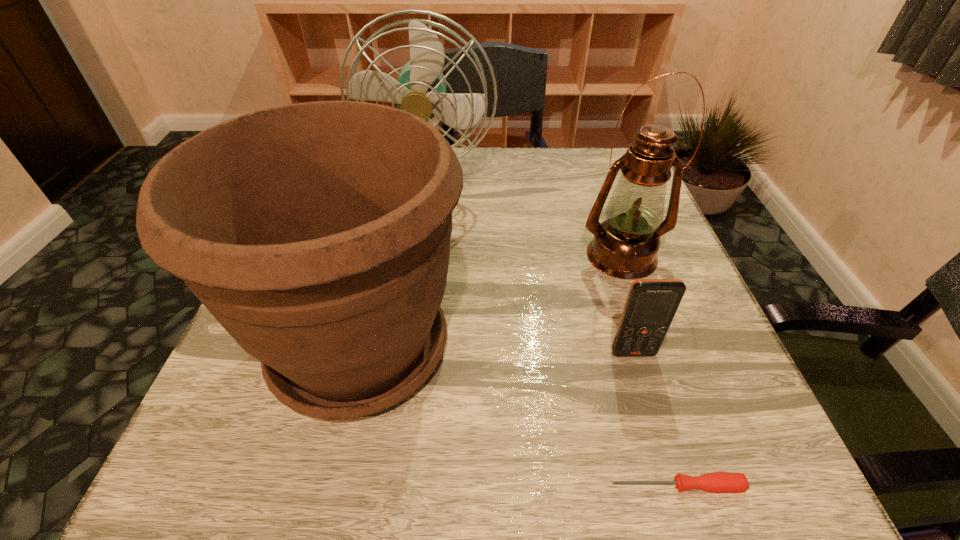
Locate an element on the screen. screwdriver that is at the right edge is located at coordinates (720, 482).

Where is `object that is at the far left corner`? Image resolution: width=960 pixels, height=540 pixels. object that is at the far left corner is located at coordinates coord(420,89).

Locate an element on the screen. object located at the near left corner is located at coordinates (317, 234).

Locate an element on the screen. The height and width of the screenshot is (540, 960). object located at the near right corner is located at coordinates (720, 482).

Locate an element on the screen. Image resolution: width=960 pixels, height=540 pixels. free spot at the far edge of the desktop is located at coordinates click(x=499, y=167).

The height and width of the screenshot is (540, 960). In order to click on free region at the near edge of the desktop in this screenshot , I will do `click(597, 498)`.

Find the location of a particular element. vacant space at the right edge of the desktop is located at coordinates (699, 328).

In the image, there is a desktop. Where is `vacant space at the far right corner`? Image resolution: width=960 pixels, height=540 pixels. vacant space at the far right corner is located at coordinates (610, 157).

In the image, there is a desktop. Identify the location of vacant space at the near right corner. (743, 451).

Locate an element on the screen. The width and height of the screenshot is (960, 540). empty location between the flowerpot and the fourth tallest object is located at coordinates click(x=496, y=350).